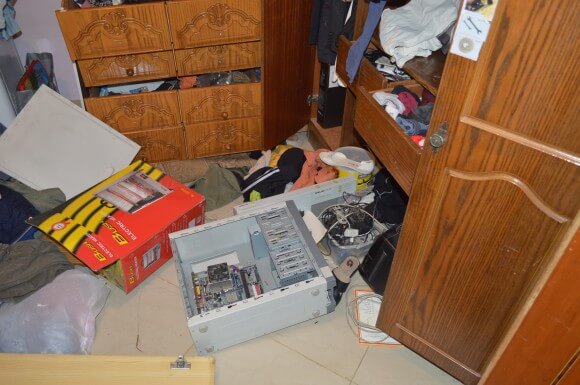
Where is `gray cord`? gray cord is located at coordinates (357, 320).